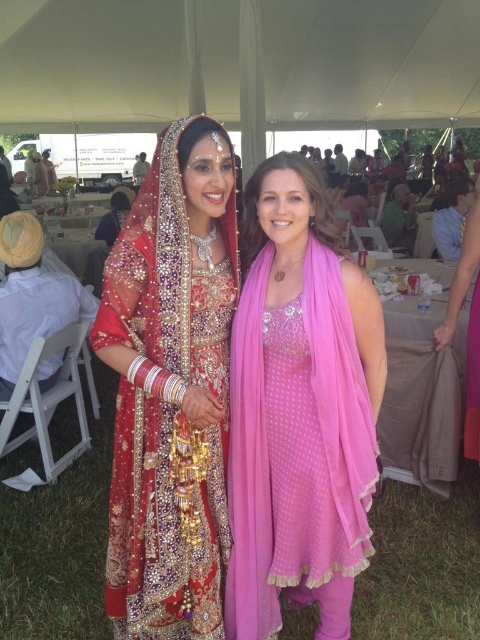
Does matte gold jewelry at center have a greater height compared to white fabric canopy at upper center?

No.

Does matte gold jewelry at center have a lesser width compared to white fabric canopy at upper center?

Yes.

Locate an element on the screen. The image size is (480, 640). matte gold jewelry at center is located at coordinates (170, 387).

I want to click on matte gold jewelry at center, so click(x=170, y=387).

Does pink sheer scarf at center have a lesser height compared to white fabric canopy at upper center?

Yes, pink sheer scarf at center is shorter than white fabric canopy at upper center.

Does point (282, 528) come farther from viewer compared to point (377, 49)?

No.

Does point (360, 333) come farther from viewer compared to point (121, 24)?

No, (360, 333) is closer to viewer.

Find the location of `pink sheer scarf at center`. pink sheer scarf at center is located at coordinates (298, 410).

Can you confirm if pink sheer scarf at center is smaller than matte gold jewelry at center?

Correct, pink sheer scarf at center occupies less space than matte gold jewelry at center.

Does pink sheer scarf at center have a greater height compared to matte gold jewelry at center?

No.

Is point (358, 332) in front of point (94, 349)?

Yes, point (358, 332) is in front of point (94, 349).

I want to click on pink sheer scarf at center, so click(298, 410).